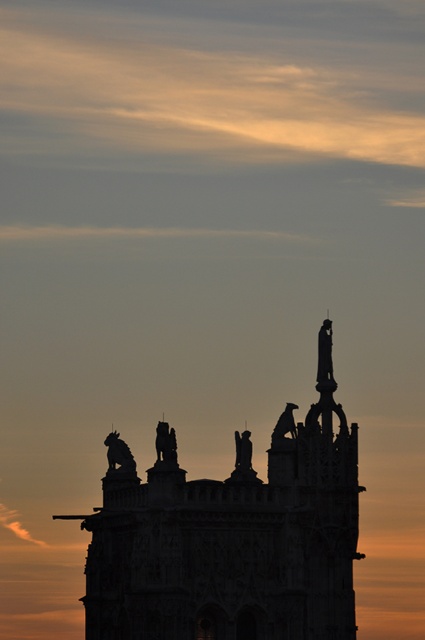
You are an architect analyzing the proportions of the building in the image. Which object, the silhouette stone tower at center or the sculpted stone figure at upper center, has a larger size in the scene?

The silhouette stone tower at center is bigger than the sculpted stone figure at upper center according to the description.

Based on the photo, based on the scene described, which object occupies a larger horizontal space in the image? The silhouette stone tower at center or the sculpted stone figure at upper center?

The silhouette stone tower at center is wider than the sculpted stone figure at upper center, so it occupies a larger horizontal space in the image.